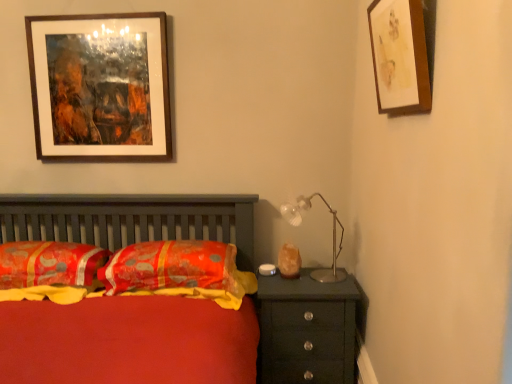
Question: Is wooden picture frame at upper left, the 2th picture frame in the front-to-back sequence, further to camera compared to metallic silver table lamp at upper right?

Choices:
 (A) yes
 (B) no

Answer: (A)

Question: Is metallic silver table lamp at upper right inside wooden picture frame at upper left, the 2th picture frame in the right-to-left sequence?

Choices:
 (A) no
 (B) yes

Answer: (A)

Question: From the image's perspective, does wooden picture frame at upper left, the 2th picture frame in the right-to-left sequence, appear lower than metallic silver table lamp at upper right?

Choices:
 (A) yes
 (B) no

Answer: (B)

Question: Considering the relative sizes of wooden picture frame at upper left, the 2th picture frame in the front-to-back sequence, and metallic silver table lamp at upper right in the image provided, is wooden picture frame at upper left, the 2th picture frame in the front-to-back sequence, wider than metallic silver table lamp at upper right?

Choices:
 (A) no
 (B) yes

Answer: (A)

Question: Is there a large distance between wooden picture frame at upper left, which is the first picture frame from left to right, and metallic silver table lamp at upper right?

Choices:
 (A) no
 (B) yes

Answer: (B)

Question: From their relative heights in the image, would you say matte black chest of drawers at right is taller or shorter than wooden picture frame at upper right, the 2th picture frame when ordered from left to right?

Choices:
 (A) tall
 (B) short

Answer: (A)

Question: Looking at their shapes, would you say matte black chest of drawers at right is wider or thinner than wooden picture frame at upper right, which ranks as the 2th picture frame in back-to-front order?

Choices:
 (A) thin
 (B) wide

Answer: (B)

Question: From the image's perspective, is matte black chest of drawers at right located above or below wooden picture frame at upper right, positioned as the first picture frame in right-to-left order?

Choices:
 (A) below
 (B) above

Answer: (A)

Question: Considering the positions of point (344, 286) and point (396, 84), is point (344, 286) closer or farther from the camera than point (396, 84)?

Choices:
 (A) closer
 (B) farther

Answer: (B)

Question: In terms of width, does metallic silver table lamp at upper right look wider or thinner when compared to wooden picture frame at upper left, the 2th picture frame in the front-to-back sequence?

Choices:
 (A) wide
 (B) thin

Answer: (A)

Question: Based on their sizes in the image, would you say metallic silver table lamp at upper right is bigger or smaller than wooden picture frame at upper left, which appears as the 1th picture frame when viewed from the back?

Choices:
 (A) small
 (B) big

Answer: (A)

Question: From their relative heights in the image, would you say metallic silver table lamp at upper right is taller or shorter than wooden picture frame at upper left, which is the first picture frame from left to right?

Choices:
 (A) short
 (B) tall

Answer: (A)

Question: Is metallic silver table lamp at upper right inside the boundaries of wooden picture frame at upper left, which appears as the 1th picture frame when viewed from the back, or outside?

Choices:
 (A) inside
 (B) outside

Answer: (B)

Question: From their relative heights in the image, would you say wooden picture frame at upper right, which is counted as the first picture frame, starting from the front, is taller or shorter than matte black chest of drawers at right?

Choices:
 (A) tall
 (B) short

Answer: (B)

Question: Is point (401, 112) positioned closer to the camera than point (321, 327)?

Choices:
 (A) farther
 (B) closer

Answer: (B)